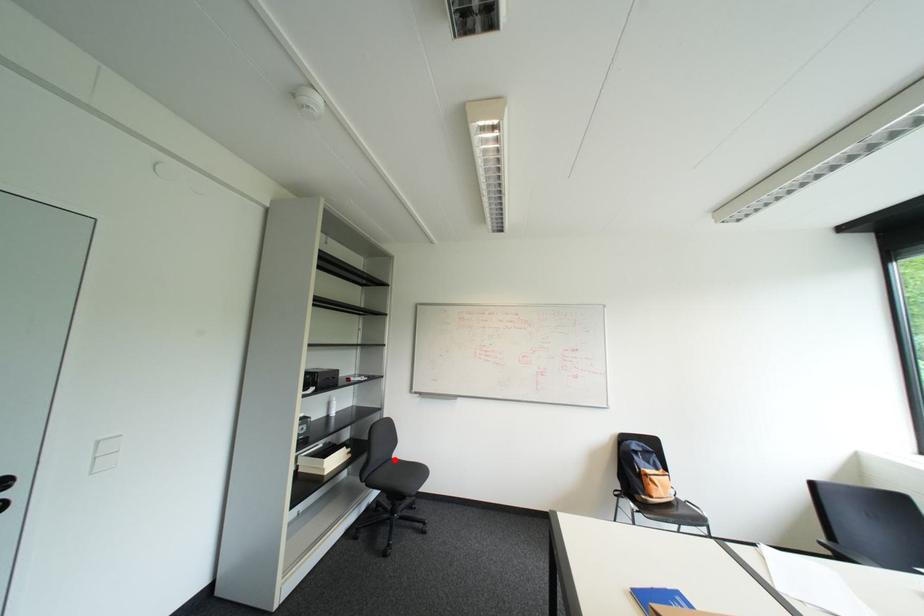
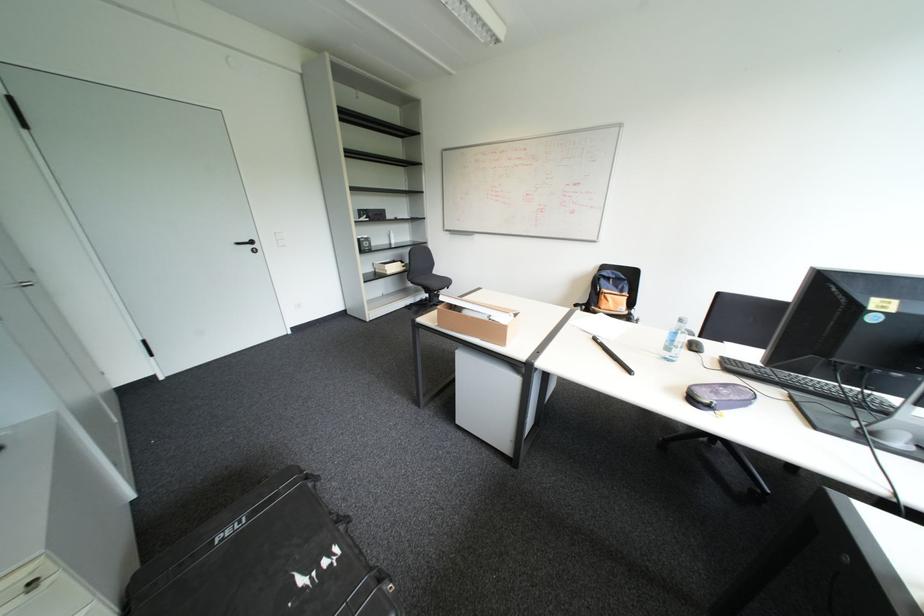
Question: I am providing you with two images of the same scene from different viewpoints. Given a red point in image1, look at the same physical point in image2. Is it:

Choices:
 (A) Closer to the viewpoint
 (B) Farther from the viewpoint

Answer: (A)